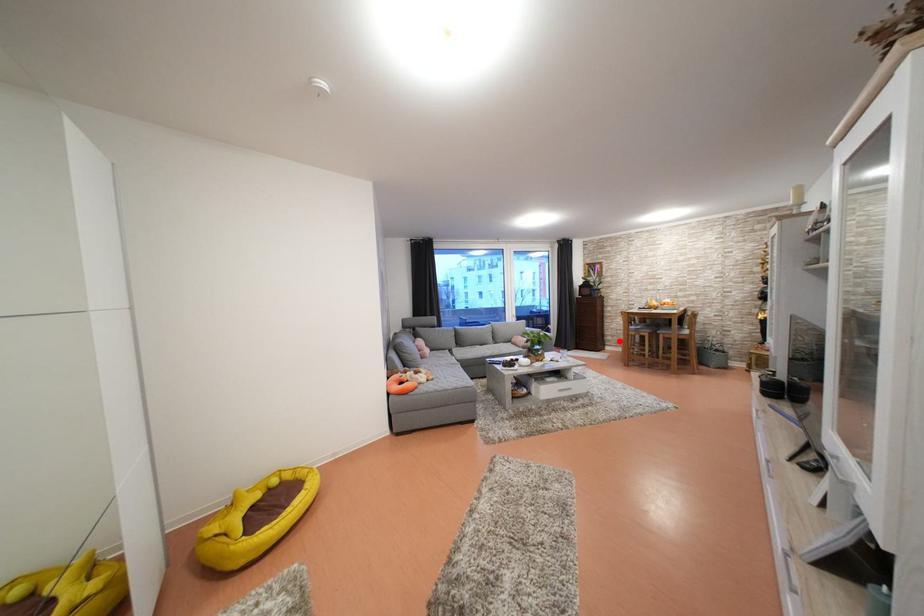
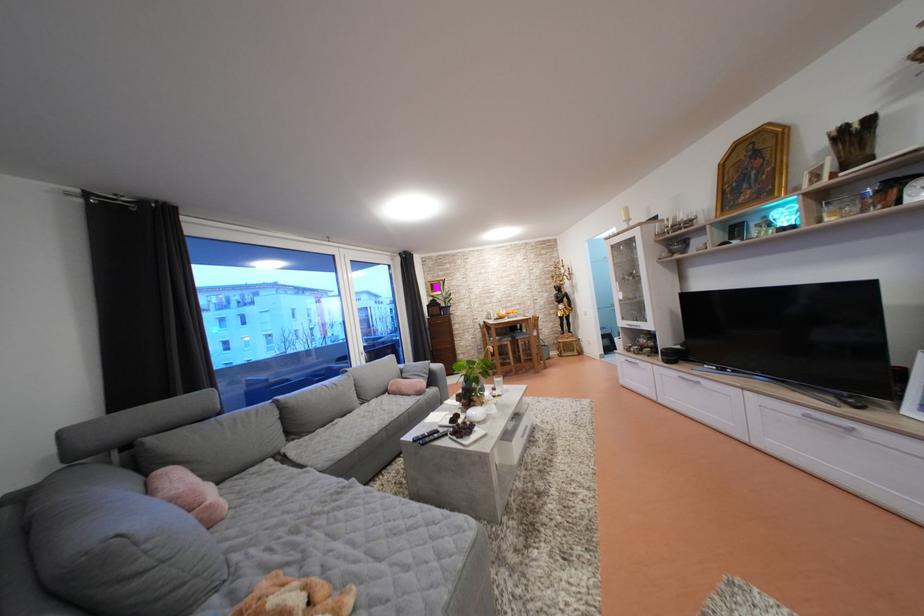
The point at the highlighted location is marked in the first image. Where is the corresponding point in the second image?

(470, 359)